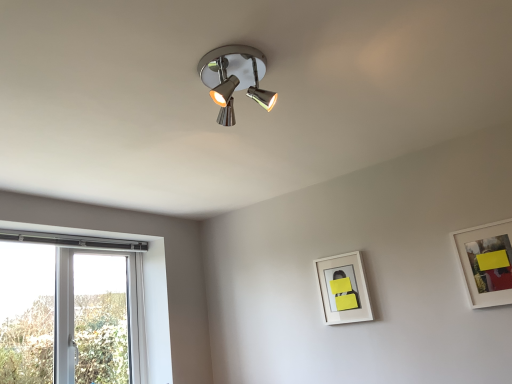
At what (x,y) coordinates should I click in order to perform the action: click on white matte picture frame at upper right, the 1th picture frame in the front-to-back sequence. Please return your answer as a coordinate pair (x, y). The height and width of the screenshot is (384, 512). Looking at the image, I should click on (486, 263).

The width and height of the screenshot is (512, 384). Describe the element at coordinates (486, 263) in the screenshot. I see `white matte picture frame at upper right, positioned as the second picture frame in back-to-front order` at that location.

How much space does white matte picture frame at upper right, which is counted as the second picture frame, starting from the left, occupy vertically?

The height of white matte picture frame at upper right, which is counted as the second picture frame, starting from the left, is 15.29 inches.

Locate an element on the screen. white matte picture frame at lower right, the 2th picture frame viewed from the front is located at coordinates pos(343,289).

Measure the distance between white matte picture frame at lower right, arranged as the first picture frame when viewed from the left, and camera.

7.55 feet.

What do you see at coordinates (343, 289) in the screenshot? The image size is (512, 384). I see `white matte picture frame at lower right, arranged as the first picture frame when viewed from the left` at bounding box center [343, 289].

How much space does white matte picture frame at lower right, arranged as the first picture frame when viewed from the left, occupy vertically?

white matte picture frame at lower right, arranged as the first picture frame when viewed from the left, is 15.10 inches in height.

In order to face white matte picture frame at lower right, the first picture frame viewed from the back, should I rotate leftwards or rightwards?

Turn right approximately 11.344 degrees to face it.

Where is `white matte picture frame at upper right, positioned as the second picture frame in back-to-front order`? The height and width of the screenshot is (384, 512). white matte picture frame at upper right, positioned as the second picture frame in back-to-front order is located at coordinates (486, 263).

Considering the positions of objects white matte picture frame at lower right, the 2th picture frame viewed from the front, and white matte picture frame at upper right, positioned as the second picture frame in back-to-front order, in the image provided, who is more to the left, white matte picture frame at lower right, the 2th picture frame viewed from the front, or white matte picture frame at upper right, positioned as the second picture frame in back-to-front order,?

white matte picture frame at lower right, the 2th picture frame viewed from the front, is more to the left.

Relative to white matte picture frame at upper right, the 1th picture frame in the front-to-back sequence, is white matte picture frame at lower right, positioned as the 2th picture frame in right-to-left order, in front or behind?

white matte picture frame at lower right, positioned as the 2th picture frame in right-to-left order, is behind white matte picture frame at upper right, the 1th picture frame in the front-to-back sequence.

Which is closer to the camera, (330, 258) or (466, 278)?

The point (466, 278) is in front.

From the image's perspective, is white matte picture frame at lower right, positioned as the 2th picture frame in right-to-left order, below white matte picture frame at upper right, which ranks as the 1th picture frame in right-to-left order?

Yes.

From a real-world perspective, which is physically above, white matte picture frame at lower right, positioned as the 2th picture frame in right-to-left order, or white matte picture frame at upper right, which is counted as the second picture frame, starting from the left?

In real-world perspective, white matte picture frame at lower right, positioned as the 2th picture frame in right-to-left order, is above.

Considering the sizes of white matte picture frame at lower right, arranged as the first picture frame when viewed from the left, and white matte picture frame at upper right, positioned as the second picture frame in back-to-front order, in the image, is white matte picture frame at lower right, arranged as the first picture frame when viewed from the left, wider or thinner than white matte picture frame at upper right, positioned as the second picture frame in back-to-front order,?

Clearly, white matte picture frame at lower right, arranged as the first picture frame when viewed from the left, has less width compared to white matte picture frame at upper right, positioned as the second picture frame in back-to-front order.

Can you confirm if white matte picture frame at lower right, the first picture frame viewed from the back, is shorter than white matte picture frame at upper right, the 1th picture frame in the front-to-back sequence?

Yes.

Between white matte picture frame at lower right, the first picture frame viewed from the back, and white matte picture frame at upper right, which is counted as the second picture frame, starting from the left, which one has smaller size?

Smaller between the two is white matte picture frame at lower right, the first picture frame viewed from the back.

Is white matte picture frame at lower right, positioned as the 2th picture frame in right-to-left order, not inside white matte picture frame at upper right, the 1th picture frame in the front-to-back sequence?

white matte picture frame at lower right, positioned as the 2th picture frame in right-to-left order, is positioned outside white matte picture frame at upper right, the 1th picture frame in the front-to-back sequence.

Is white matte picture frame at lower right, the first picture frame viewed from the back, in contact with white matte picture frame at upper right, which is counted as the second picture frame, starting from the left?

No.

Is white matte picture frame at upper right, the 1th picture frame in the front-to-back sequence, at the back of white matte picture frame at lower right, positioned as the 2th picture frame in right-to-left order?

white matte picture frame at lower right, positioned as the 2th picture frame in right-to-left order, does not have its back to white matte picture frame at upper right, the 1th picture frame in the front-to-back sequence.

Measure the distance between white matte picture frame at lower right, arranged as the first picture frame when viewed from the left, and white matte picture frame at upper right, positioned as the second picture frame in back-to-front order.

white matte picture frame at lower right, arranged as the first picture frame when viewed from the left, and white matte picture frame at upper right, positioned as the second picture frame in back-to-front order, are 62.71 centimeters apart from each other.

This screenshot has height=384, width=512. In order to click on picture frame behind the white matte picture frame at upper right, which is counted as the second picture frame, starting from the left in this screenshot , I will do `click(343, 289)`.

Which object is positioned more to the right, white matte picture frame at upper right, which ranks as the 1th picture frame in right-to-left order, or white matte picture frame at lower right, the first picture frame viewed from the back?

white matte picture frame at upper right, which ranks as the 1th picture frame in right-to-left order.

Relative to white matte picture frame at lower right, arranged as the first picture frame when viewed from the left, is white matte picture frame at upper right, the 1th picture frame in the front-to-back sequence, in front or behind?

Clearly, white matte picture frame at upper right, the 1th picture frame in the front-to-back sequence, is in front of white matte picture frame at lower right, arranged as the first picture frame when viewed from the left.

Which is less distant, (501,244) or (335,292)?

Point (501,244).

From the image's perspective, is white matte picture frame at upper right, the 1th picture frame in the front-to-back sequence, positioned above or below white matte picture frame at lower right, positioned as the 2th picture frame in right-to-left order?

From the image's perspective, white matte picture frame at upper right, the 1th picture frame in the front-to-back sequence, appears above white matte picture frame at lower right, positioned as the 2th picture frame in right-to-left order.

From a real-world perspective, who is located lower, white matte picture frame at upper right, which ranks as the 1th picture frame in right-to-left order, or white matte picture frame at lower right, arranged as the first picture frame when viewed from the left?

white matte picture frame at upper right, which ranks as the 1th picture frame in right-to-left order, from a real-world perspective.

Can you confirm if white matte picture frame at upper right, which ranks as the 1th picture frame in right-to-left order, is thinner than white matte picture frame at lower right, the first picture frame viewed from the back?

No, white matte picture frame at upper right, which ranks as the 1th picture frame in right-to-left order, is not thinner than white matte picture frame at lower right, the first picture frame viewed from the back.

Is white matte picture frame at upper right, which ranks as the 1th picture frame in right-to-left order, taller than white matte picture frame at lower right, the first picture frame viewed from the back?

Yes, white matte picture frame at upper right, which ranks as the 1th picture frame in right-to-left order, is taller than white matte picture frame at lower right, the first picture frame viewed from the back.

Between white matte picture frame at upper right, which ranks as the 1th picture frame in right-to-left order, and white matte picture frame at lower right, the first picture frame viewed from the back, which one has larger size?

Bigger between the two is white matte picture frame at upper right, which ranks as the 1th picture frame in right-to-left order.

Would you say white matte picture frame at upper right, which ranks as the 1th picture frame in right-to-left order, is outside white matte picture frame at lower right, arranged as the first picture frame when viewed from the left?

Absolutely, white matte picture frame at upper right, which ranks as the 1th picture frame in right-to-left order, is external to white matte picture frame at lower right, arranged as the first picture frame when viewed from the left.

Is white matte picture frame at upper right, which is counted as the second picture frame, starting from the left, not near white matte picture frame at lower right, positioned as the 2th picture frame in right-to-left order?

No.

Is white matte picture frame at upper right, which ranks as the 1th picture frame in right-to-left order, facing towards white matte picture frame at lower right, the first picture frame viewed from the back?

No, white matte picture frame at upper right, which ranks as the 1th picture frame in right-to-left order, is not turned towards white matte picture frame at lower right, the first picture frame viewed from the back.

How far apart are white matte picture frame at upper right, the 1th picture frame in the front-to-back sequence, and white matte picture frame at lower right, the 2th picture frame viewed from the front?

white matte picture frame at upper right, the 1th picture frame in the front-to-back sequence, and white matte picture frame at lower right, the 2th picture frame viewed from the front, are 24.69 inches apart from each other.

Find the location of a particular element. picture frame lying on the right of white matte picture frame at lower right, the first picture frame viewed from the back is located at coordinates (486, 263).

This screenshot has width=512, height=384. I want to click on picture frame directly beneath the white matte picture frame at lower right, the 2th picture frame viewed from the front (from a real-world perspective), so click(486, 263).

Where is `picture frame behind the white matte picture frame at upper right, the 1th picture frame in the front-to-back sequence`? The height and width of the screenshot is (384, 512). picture frame behind the white matte picture frame at upper right, the 1th picture frame in the front-to-back sequence is located at coordinates (343, 289).